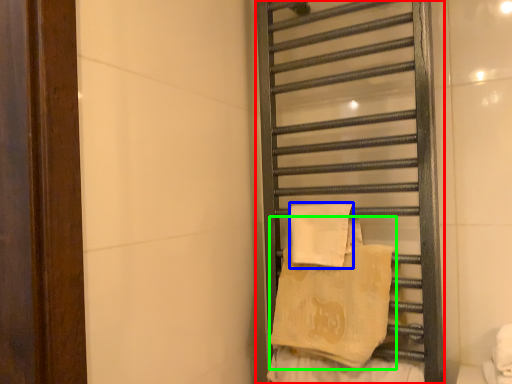
Question: Which is farther away from towel rack (highlighted by a red box)? beach towel (highlighted by a blue box) or beach towel (highlighted by a green box)?

Choices:
 (A) beach towel
 (B) beach towel

Answer: (A)